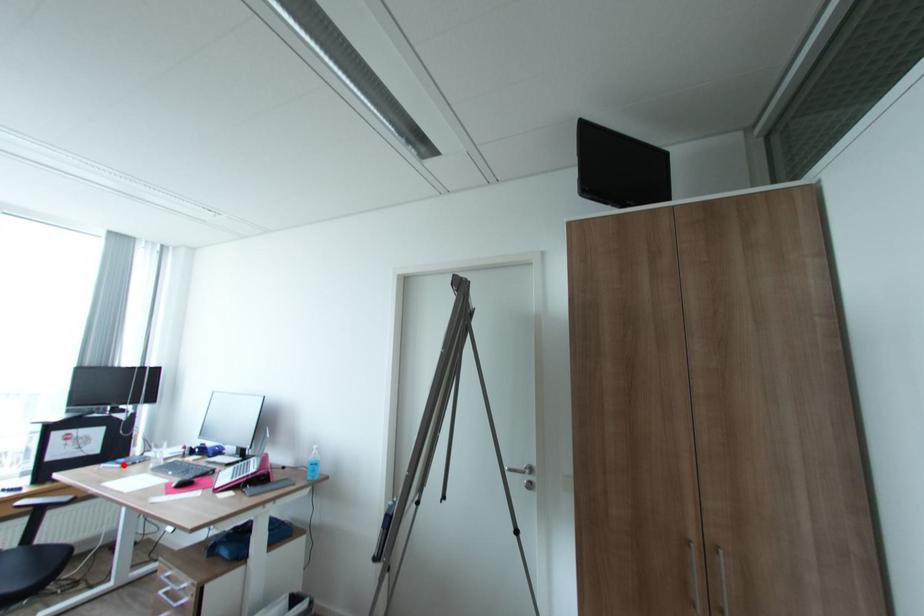
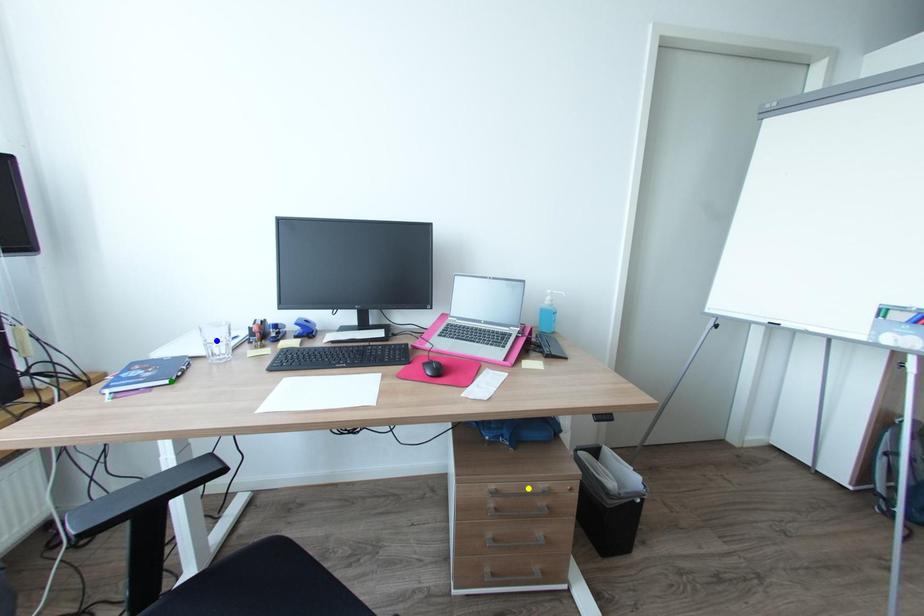
Question: I am providing you with two images of the same scene from different viewpoints. A red point is marked on the first image. You are given multiple points on the second image. Which mark in image 2 goes with the point in image 1?

Choices:
 (A) blue point
 (B) green point
 (C) yellow point

Answer: (B)